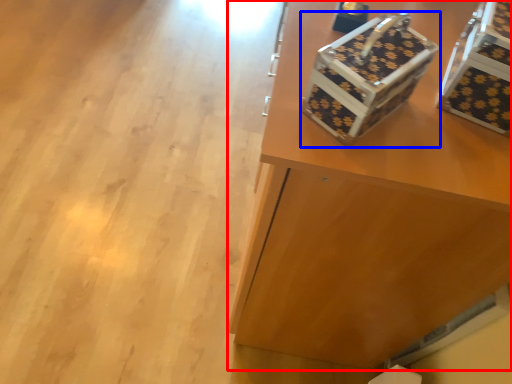
Question: Which of the following is the farthest to the observer, furniture (highlighted by a red box) or shoe box (highlighted by a blue box)?

Choices:
 (A) furniture
 (B) shoe box

Answer: (A)